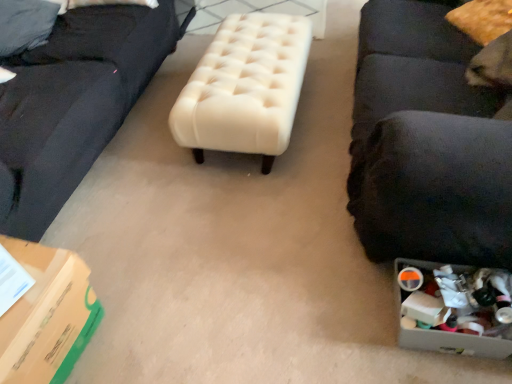
Question: Is creamy velvet ottoman at center at the right side of plastic container at lower right?

Choices:
 (A) no
 (B) yes

Answer: (A)

Question: From the image's perspective, is creamy velvet ottoman at center above plastic container at lower right?

Choices:
 (A) no
 (B) yes

Answer: (B)

Question: Considering the relative sizes of creamy velvet ottoman at center and plastic container at lower right in the image provided, is creamy velvet ottoman at center smaller than plastic container at lower right?

Choices:
 (A) no
 (B) yes

Answer: (A)

Question: Does creamy velvet ottoman at center come in front of plastic container at lower right?

Choices:
 (A) yes
 (B) no

Answer: (B)

Question: Is creamy velvet ottoman at center completely or partially outside of plastic container at lower right?

Choices:
 (A) no
 (B) yes

Answer: (B)

Question: From a real-world perspective, is creamy velvet ottoman at center on top of plastic container at lower right?

Choices:
 (A) no
 (B) yes

Answer: (B)

Question: Is plastic container at lower right oriented towards green cardboard box at lower left?

Choices:
 (A) yes
 (B) no

Answer: (B)

Question: Is plastic container at lower right positioned with its back to green cardboard box at lower left?

Choices:
 (A) yes
 (B) no

Answer: (B)

Question: Is plastic container at lower right located outside green cardboard box at lower left?

Choices:
 (A) no
 (B) yes

Answer: (B)

Question: From a real-world perspective, is plastic container at lower right physically above green cardboard box at lower left?

Choices:
 (A) yes
 (B) no

Answer: (B)

Question: Considering the relative sizes of plastic container at lower right and green cardboard box at lower left in the image provided, is plastic container at lower right thinner than green cardboard box at lower left?

Choices:
 (A) yes
 (B) no

Answer: (A)

Question: From the image's perspective, would you say plastic container at lower right is positioned over green cardboard box at lower left?

Choices:
 (A) yes
 (B) no

Answer: (A)

Question: Is creamy velvet ottoman at center not within black fabric studio couch at right?

Choices:
 (A) no
 (B) yes

Answer: (B)